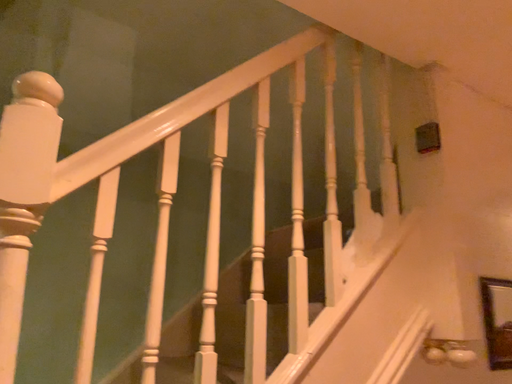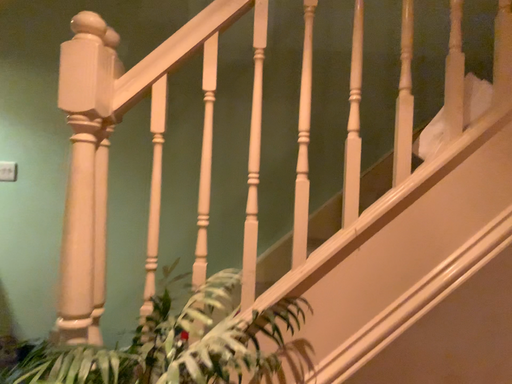
Question: How did the camera likely rotate when shooting the video?

Choices:
 (A) rotated downward
 (B) rotated upward

Answer: (A)